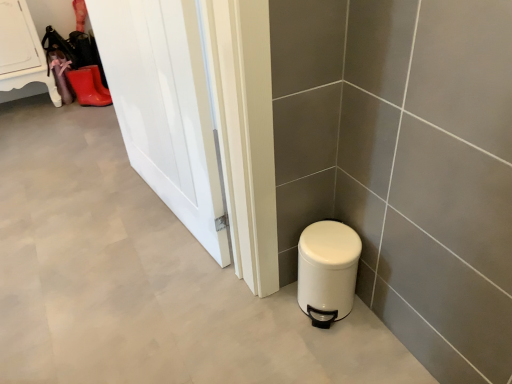
Question: Is white glossy door at left to the left or to the right of white matte trash can at lower right in the image?

Choices:
 (A) left
 (B) right

Answer: (A)

Question: In terms of height, does white glossy door at left look taller or shorter compared to white matte trash can at lower right?

Choices:
 (A) short
 (B) tall

Answer: (B)

Question: Estimate the real-world distances between objects in this image. Which object is closer to the white glossy door at left?

Choices:
 (A) rubber matte boot at upper left
 (B) white matte trash can at lower right

Answer: (B)

Question: Which object is the farthest from the rubber matte boot at upper left?

Choices:
 (A) white matte trash can at lower right
 (B) white glossy door at left

Answer: (A)